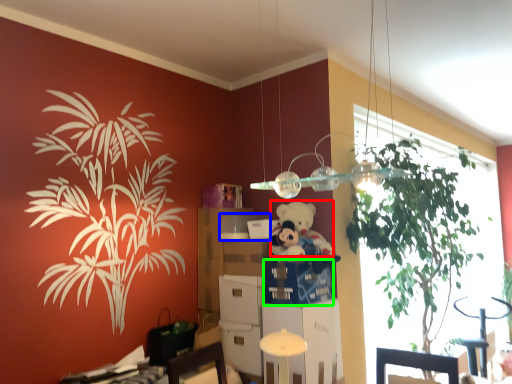
Question: Considering the real-world distances, which object is closest to teddy (highlighted by a red box)? box (highlighted by a blue box) or drawer (highlighted by a green box).

Choices:
 (A) box
 (B) drawer

Answer: (B)